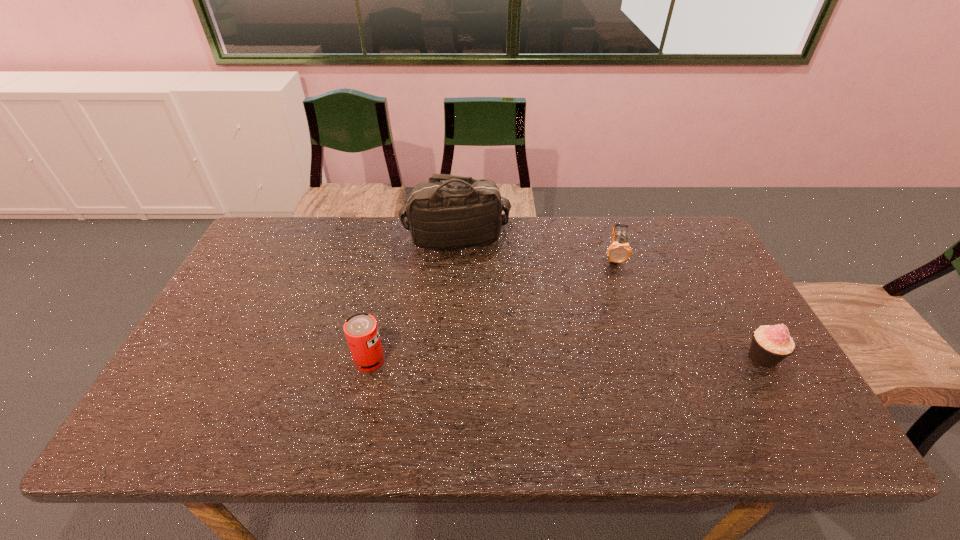
Identify which object is located as the third nearest to the shoulder bag. Please provide its 2D coordinates. Your answer should be formatted as a tuple, i.e. [(x, y)], where the tuple contains the x and y coordinates of a point satisfying the conditions above.

[(770, 345)]

Locate an element on the screen. vacant space that satisfies the following two spatial constraints: 1. on the front side of the rightmost object; 2. on the right side of the second object from right to left is located at coordinates (646, 356).

This screenshot has width=960, height=540. I want to click on vacant space that satisfies the following two spatial constraints: 1. on the front side of the shoulder bag; 2. on the left side of the second object from right to left, so click(x=454, y=258).

The height and width of the screenshot is (540, 960). I want to click on free space that satisfies the following two spatial constraints: 1. on the front side of the second object from right to left; 2. on the left side of the cupcake, so click(646, 356).

Identify the location of vacant space that satisfies the following two spatial constraints: 1. on the back side of the can; 2. on the right side of the rightmost object. (371, 356).

In order to click on free space that satisfies the following two spatial constraints: 1. on the back side of the can; 2. on the right side of the cupcake in this screenshot , I will do `click(371, 356)`.